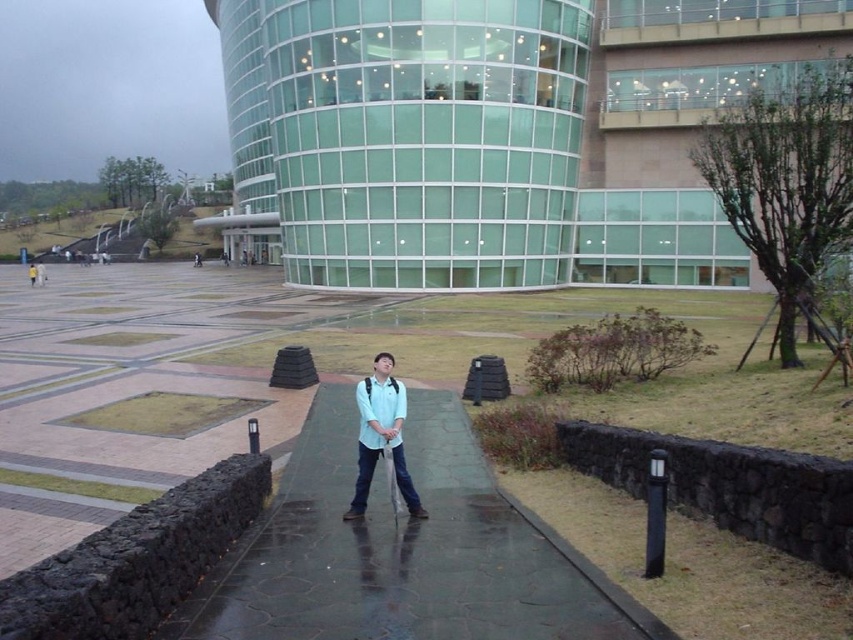
Question: Considering the relative positions of smooth concrete path at center and matte blue shirt at center in the image provided, where is smooth concrete path at center located with respect to matte blue shirt at center?

Choices:
 (A) right
 (B) left

Answer: (A)

Question: From the image, what is the correct spatial relationship of smooth concrete path at center in relation to matte blue shirt at center?

Choices:
 (A) above
 (B) below

Answer: (B)

Question: Considering the relative positions of smooth concrete path at center and matte blue shirt at center in the image provided, where is smooth concrete path at center located with respect to matte blue shirt at center?

Choices:
 (A) below
 (B) above

Answer: (A)

Question: Which point appears farthest from the camera in this image?

Choices:
 (A) click(531, 512)
 (B) click(368, 417)

Answer: (A)